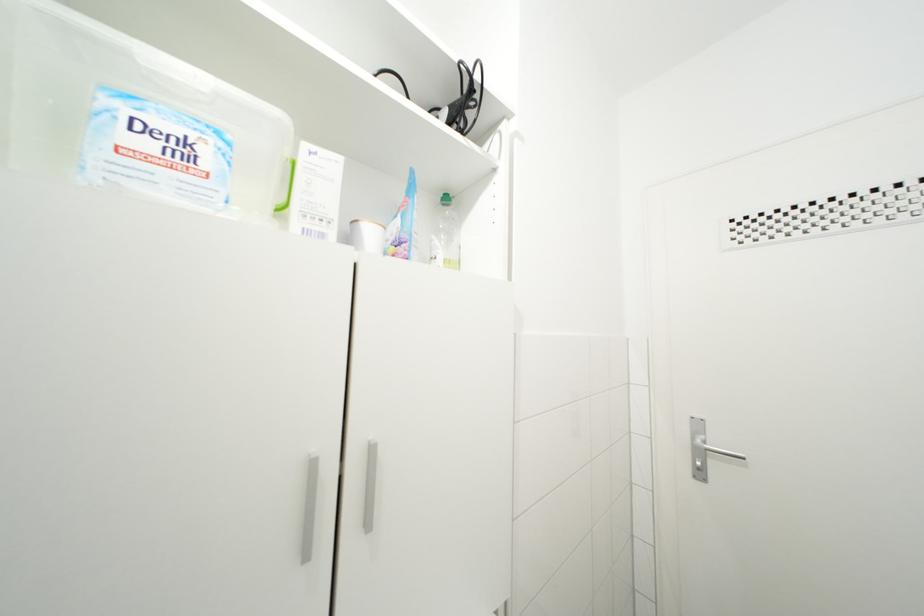
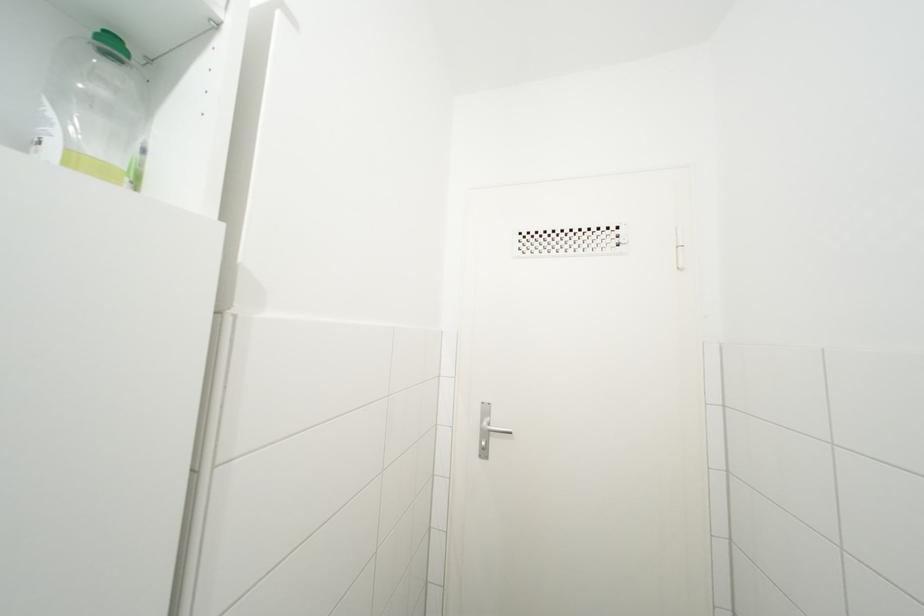
Question: The camera is either moving clockwise (left) or counter-clockwise (right) around the object. The first image is from the beginning of the video and the second image is from the end. Is the camera moving left or right when shooting the video?

Choices:
 (A) Left
 (B) Right

Answer: (A)